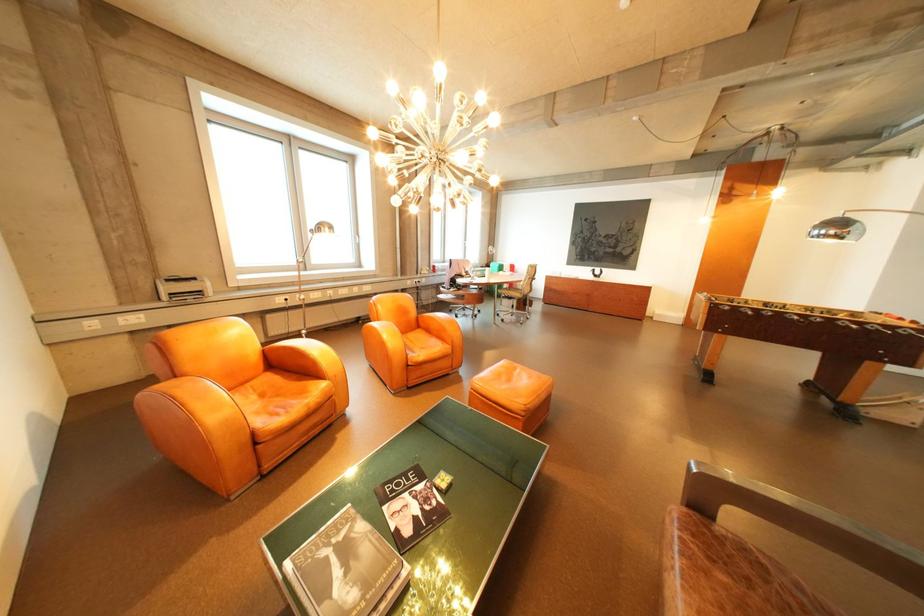
Identify the location of brown chair sitting surface. The width and height of the screenshot is (924, 616). (736, 578).